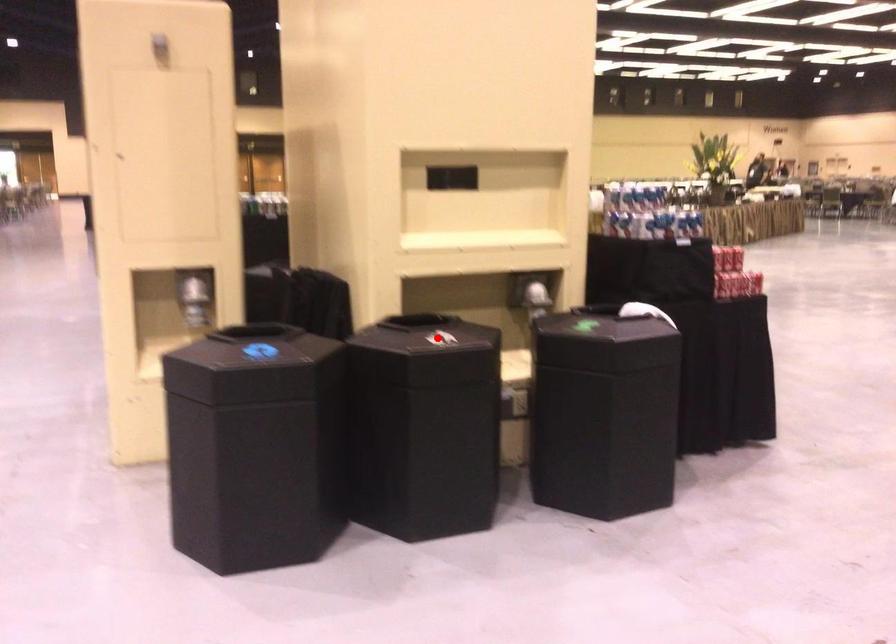
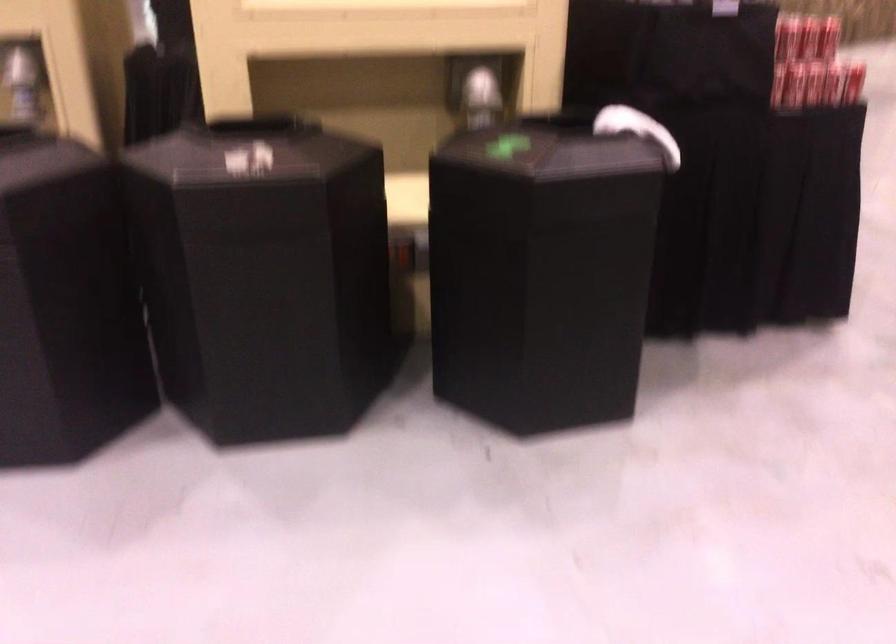
The point at the highlighted location is marked in the first image. Where is the corresponding point in the second image?

(271, 154)